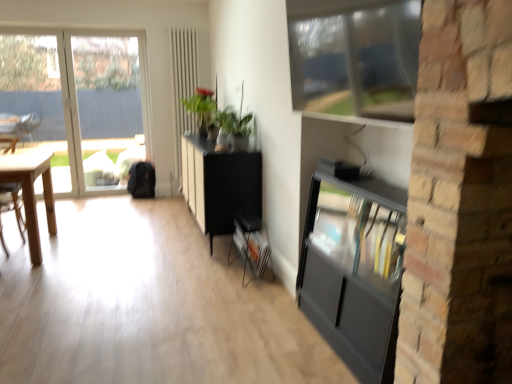
Question: Based on their sizes in the image, would you say metallic gray magazine rack at center is bigger or smaller than transparent glass window at left, marked as the 1th window in a back-to-front arrangement?

Choices:
 (A) small
 (B) big

Answer: (A)

Question: Relative to transparent glass window at left, which is the 1th window in left-to-right order, is metallic gray magazine rack at center in front or behind?

Choices:
 (A) behind
 (B) front

Answer: (B)

Question: Estimate the real-world distances between objects in this image. Which object is farther from the black matte cabinet at center?

Choices:
 (A) clear glass window at upper center, the 2th window from the back
 (B) white matte radiator at upper center
 (C) transparent glass window at left, which is the second window from front to back
 (D) light wood desk at left
 (E) metallic gray magazine rack at center

Answer: (C)

Question: Estimate the real-world distances between objects in this image. Which object is closer to the black matte cabinet at center?

Choices:
 (A) metallic gray magazine rack at center
 (B) light wood desk at left
 (C) clear glass window at upper center, the 1th window viewed from the right
 (D) transparent glass window at left, which is the 1th window in left-to-right order
 (E) white matte radiator at upper center

Answer: (A)